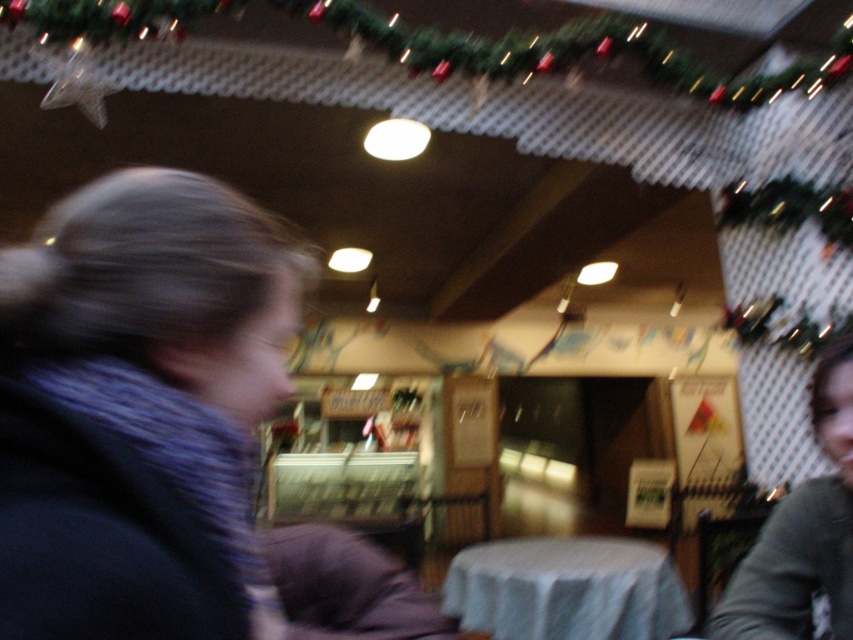
Does point (151, 276) come behind point (643, 600)?

No, (151, 276) is in front of (643, 600).

In the scene shown: Between blue knitted scarf at left and white cloth table at center, which one has more height?

Standing taller between the two is white cloth table at center.

What do you see at coordinates (134, 400) in the screenshot?
I see `blue knitted scarf at left` at bounding box center [134, 400].

Find the location of a particular element. blue knitted scarf at left is located at coordinates (134, 400).

Is point (77, 560) positioned in front of point (822, 365)?

Yes, it is.

Which is in front, point (189, 202) or point (805, 604)?

Point (189, 202)

The width and height of the screenshot is (853, 640). What do you see at coordinates (134, 400) in the screenshot? I see `blue knitted scarf at left` at bounding box center [134, 400].

At what (x,y) coordinates should I click in order to perform the action: click on blue knitted scarf at left. Please return your answer as a coordinate pair (x, y). Looking at the image, I should click on (134, 400).

Does white cloth table at center have a lesser height compared to gray fabric shirt at lower right?

Indeed, white cloth table at center has a lesser height compared to gray fabric shirt at lower right.

You are a GUI agent. You are given a task and a screenshot of the screen. Output one action in this format:
    pyautogui.click(x=<x>, y=<y>)
    Task: Click on the white cloth table at center
    The width and height of the screenshot is (853, 640).
    Given the screenshot: What is the action you would take?
    pyautogui.click(x=567, y=589)

I want to click on white cloth table at center, so click(x=567, y=589).